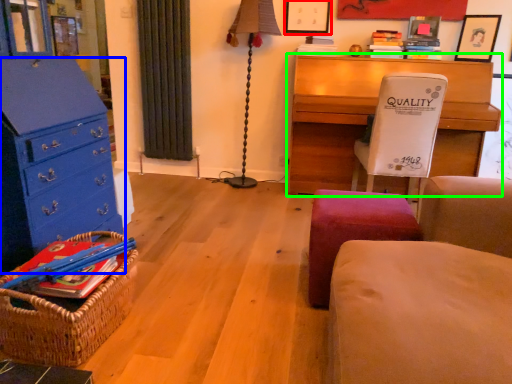
Question: Which is nearer to the picture frame (highlighted by a red box)? chest of drawers (highlighted by a blue box) or desk (highlighted by a green box).

Choices:
 (A) chest of drawers
 (B) desk

Answer: (B)